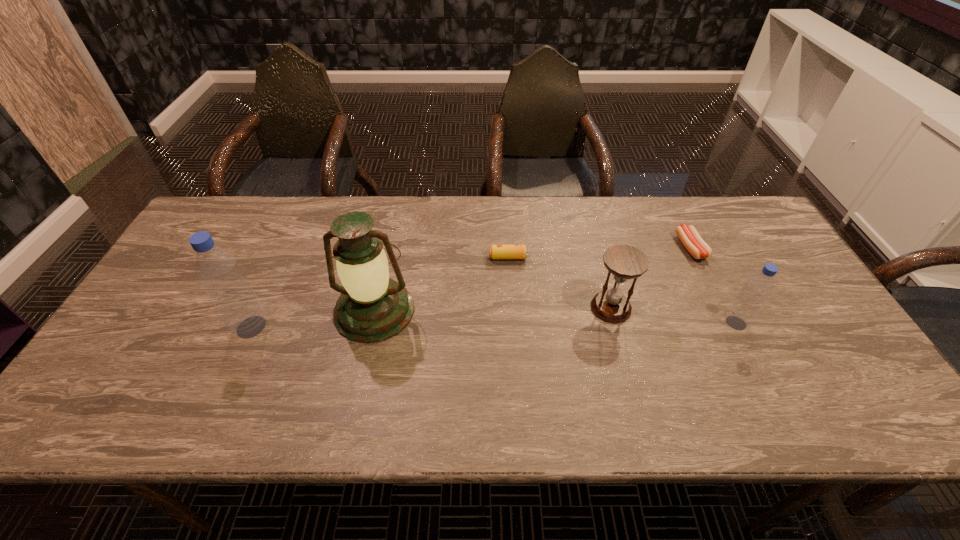
Identify the location of the taller bottle. (218, 271).

This screenshot has height=540, width=960. Identify the location of the left bottle. (x=218, y=271).

In order to click on the right bottle in this screenshot , I will do `click(745, 308)`.

Identify the location of sausage. (695, 245).

Locate an element on the screen. The width and height of the screenshot is (960, 540). hourglass is located at coordinates (624, 262).

You are a GUI agent. You are given a task and a screenshot of the screen. Output one action in this format:
    pyautogui.click(x=<x>, y=<y>)
    Task: Click on the beer can
    The height and width of the screenshot is (540, 960).
    Given the screenshot: What is the action you would take?
    click(495, 251)

Where is `lantern`? lantern is located at coordinates (372, 307).

This screenshot has width=960, height=540. Identify the location of vacant space positioned 0.190m on the left of the left bottle. (159, 327).

Identify the location of vacant space situated 0.170m on the left of the right bottle. (658, 323).

You are a GUI agent. You are given a task and a screenshot of the screen. Output one action in this format:
    pyautogui.click(x=<x>, y=<y>)
    Task: Click on the vacant position located on the back of the sausage
    
    Given the screenshot: What is the action you would take?
    pyautogui.click(x=677, y=220)